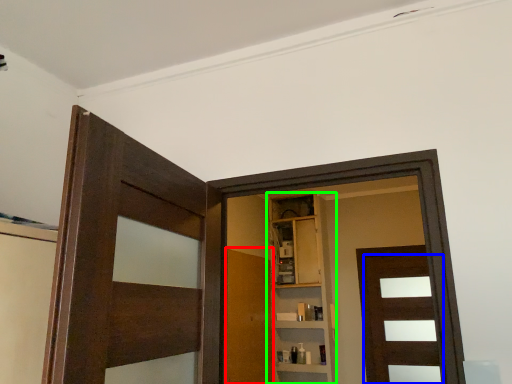
Question: Estimate the real-world distances between objects in this image. Which object is closer to door (highlighted by a red box), door (highlighted by a blue box) or cabinetry (highlighted by a green box)?

Choices:
 (A) door
 (B) cabinetry

Answer: (B)